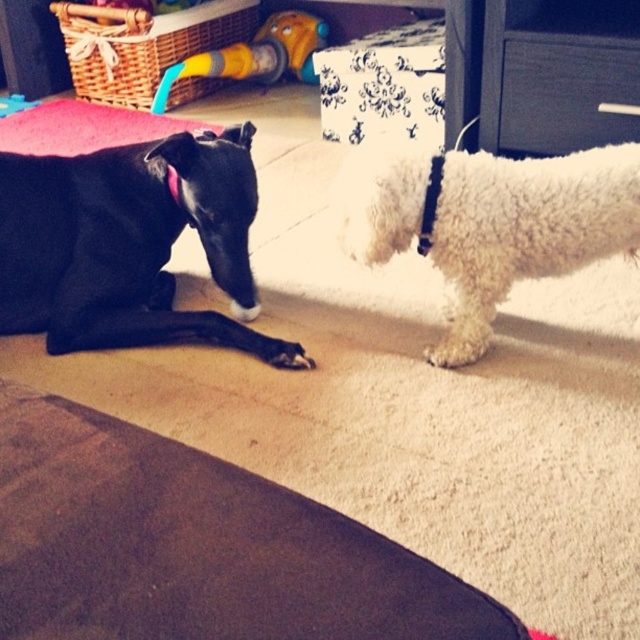
You are standing at the point marked by the coordinates point (x=564, y=93). Which object are you standing on?

You are standing on the black plastic drawer at upper right.

You are standing in the room and see the black dog lying on the left and the white fluffy dog at right. If you want to place a treat exactly at the point labeled as point (525,228), which dog will the treat land closer to?

The treat placed at point (525,228) will land closer to the white fluffy dog at right because the point corresponds to its location.

You are a dog trainer observing the scene. You notice the white fluffy dog at right and the pink fabric neckband at center. Can you tell me which one is positioned lower in the image?

The white fluffy dog at right is located below the pink fabric neckband at center, so the white fluffy dog at right is positioned lower in the image.